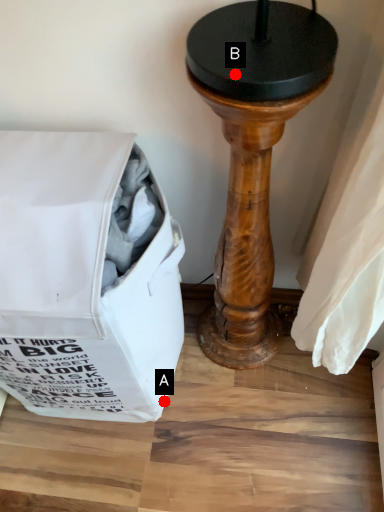
Question: Two points are circled on the image, labeled by A and B beside each circle. Which point is farther from the camera taking this photo?

Choices:
 (A) A is further
 (B) B is further

Answer: (A)